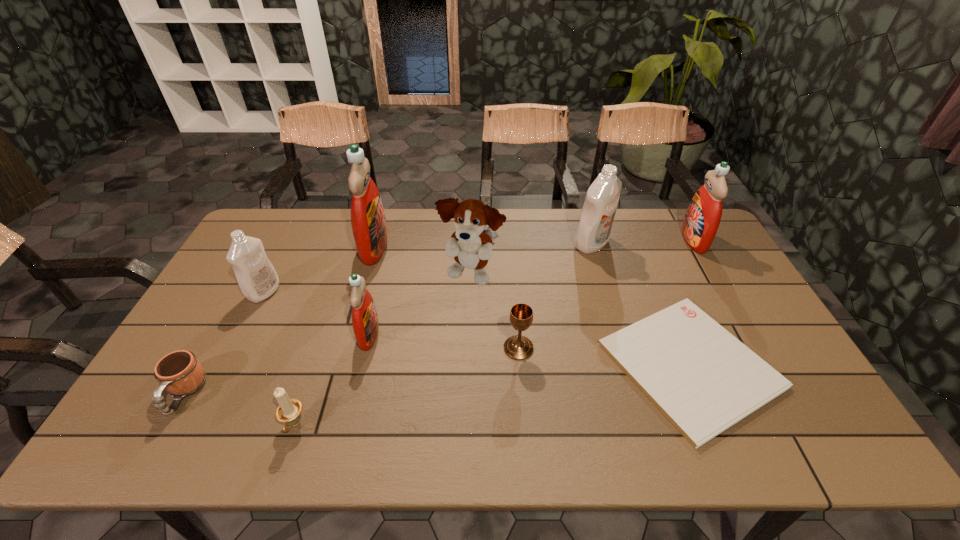
The image size is (960, 540). Find the location of `the tallest object`. the tallest object is located at coordinates (369, 227).

Identify the location of the tallest detergent. This screenshot has height=540, width=960. (369, 227).

Image resolution: width=960 pixels, height=540 pixels. In order to click on the bigger white detergent in this screenshot , I will do `click(601, 202)`.

Find the location of a particular element. The width and height of the screenshot is (960, 540). the right white detergent is located at coordinates (601, 202).

The image size is (960, 540). Identify the location of the second smallest red detergent. (703, 216).

Image resolution: width=960 pixels, height=540 pixels. I want to click on the rightmost detergent, so click(703, 216).

Locate an element on the screen. brown puppy is located at coordinates (471, 245).

Identify the location of the left white detergent. The height and width of the screenshot is (540, 960). (256, 276).

The height and width of the screenshot is (540, 960). What are the coordinates of `the leftmost detergent` in the screenshot? It's located at (256, 276).

Identify the location of the nearest red detergent. (365, 323).